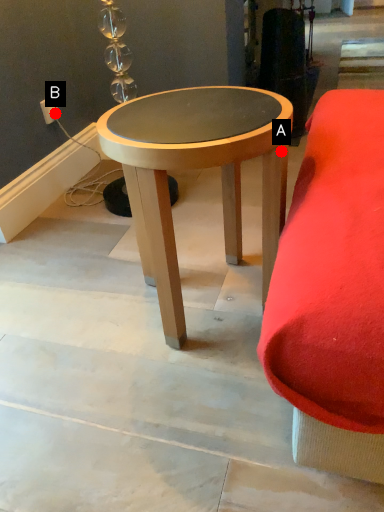
Question: Two points are circled on the image, labeled by A and B beside each circle. Which point is further to the camera?

Choices:
 (A) A is further
 (B) B is further

Answer: (B)